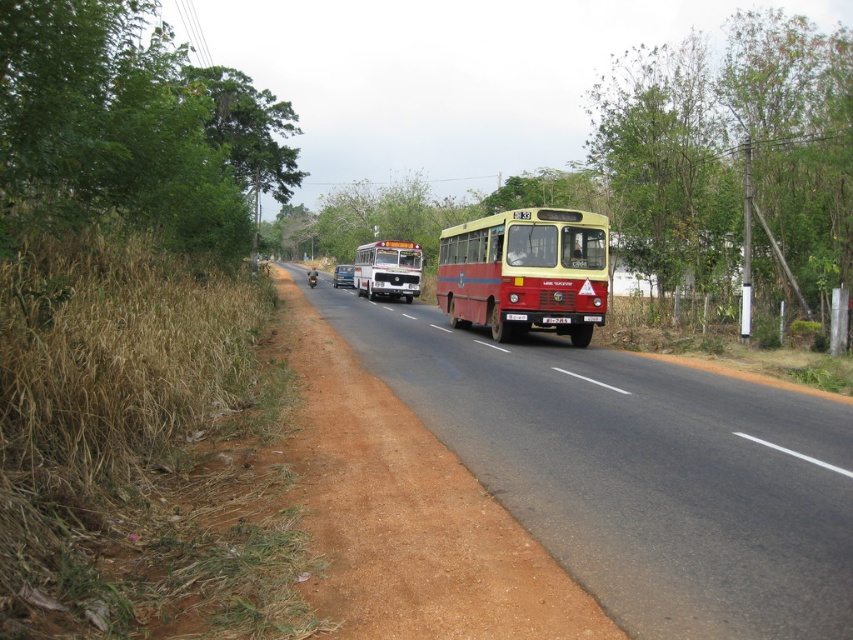
Question: Can you confirm if green leafy tree at center is positioned above brown dirt track at center?

Choices:
 (A) no
 (B) yes

Answer: (B)

Question: Which object is farther from the camera taking this photo?

Choices:
 (A) green leafy tree at center
 (B) matte yellow bus at center
 (C) green leafy tree at left

Answer: (B)

Question: Which of the following is the closest to the observer?

Choices:
 (A) (722, 225)
 (B) (564, 227)
 (C) (405, 291)
 (D) (299, 176)

Answer: (B)

Question: Does red matte bus at center have a larger size compared to matte yellow bus at center?

Choices:
 (A) no
 (B) yes

Answer: (A)

Question: Among these points, which one is nearest to the camera?

Choices:
 (A) (405, 266)
 (B) (308, 472)

Answer: (B)

Question: Is green leafy tree at left thinner than matte yellow bus at center?

Choices:
 (A) no
 (B) yes

Answer: (A)